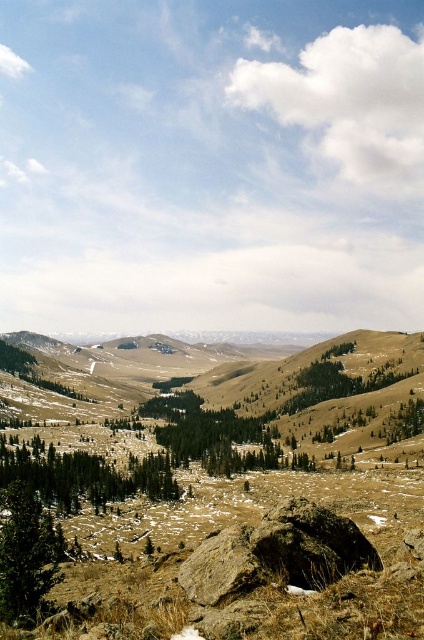
Does brown rough rock at center appear over green matte tree at center?

Yes, brown rough rock at center is above green matte tree at center.

Does brown rough rock at center have a lesser width compared to green matte tree at center?

Yes.

This screenshot has width=424, height=640. I want to click on brown rough rock at center, so click(x=276, y=554).

The width and height of the screenshot is (424, 640). What are the coordinates of `brown rough rock at center` in the screenshot? It's located at tap(276, 554).

Does green matte tree at center have a smaller size compared to green matte tree at lower left?

Indeed, green matte tree at center has a smaller size compared to green matte tree at lower left.

Can you confirm if green matte tree at center is thinner than green matte tree at lower left?

In fact, green matte tree at center might be wider than green matte tree at lower left.

Where is `green matte tree at center`? Image resolution: width=424 pixels, height=640 pixels. green matte tree at center is located at coordinates (83, 476).

Between point (335, 572) and point (30, 552), which one is positioned behind?

The point (30, 552) is more distant.

Between point (295, 508) and point (2, 531), which one is positioned in front?

Point (295, 508) is in front.

Which is in front, point (286, 548) or point (10, 541)?

Positioned in front is point (286, 548).

Identify the location of brown rough rock at center. (276, 554).